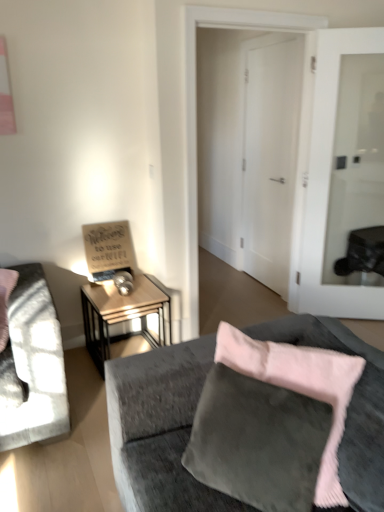
This screenshot has width=384, height=512. What do you see at coordinates (324, 178) in the screenshot?
I see `white glass door at center, the 2th door from the left` at bounding box center [324, 178].

This screenshot has width=384, height=512. Describe the element at coordinates (270, 157) in the screenshot. I see `white smooth door at center, the first door from the left` at that location.

Image resolution: width=384 pixels, height=512 pixels. What do you see at coordinates (123, 282) in the screenshot? I see `metallic silver table lamp at left` at bounding box center [123, 282].

Where is `white glass door at center, the 2th door from the left`? white glass door at center, the 2th door from the left is located at coordinates point(324,178).

Is metallic silver table lamp at left at the back of white glass door at center, the 2th door from the left?

No.

Is white glass door at center, the 2th door from the left, outside of metallic silver table lamp at left?

Absolutely, white glass door at center, the 2th door from the left, is external to metallic silver table lamp at left.

Which object is closer to the camera, white glass door at center, the 2th door from the left, or metallic silver table lamp at left?

white glass door at center, the 2th door from the left, is in front.

Which object is thinner, velvet gray couch at lower right or white smooth door at center, the 2th door positioned from the right?

white smooth door at center, the 2th door positioned from the right, is thinner.

Is velvet gray couch at lower right positioned before white smooth door at center, the 2th door positioned from the right?

Yes, velvet gray couch at lower right is in front of white smooth door at center, the 2th door positioned from the right.

In terms of size, does velvet gray couch at lower right appear bigger or smaller than white smooth door at center, the first door from the left?

Clearly, velvet gray couch at lower right is larger in size than white smooth door at center, the first door from the left.

Find the location of a particular element. This screenshot has width=384, height=512. studio couch located on the left of white smooth door at center, the first door from the left is located at coordinates (157, 425).

From the image's perspective, is metallic silver table lamp at left located above or below white smooth door at center, the first door from the left?

metallic silver table lamp at left is below white smooth door at center, the first door from the left.

Is point (114, 283) closer to viewer compared to point (269, 52)?

Yes, point (114, 283) is closer to viewer.

Is metallic silver table lamp at left not inside white smooth door at center, the 2th door positioned from the right?

Absolutely, metallic silver table lamp at left is external to white smooth door at center, the 2th door positioned from the right.

Considering the sizes of objects metallic silver table lamp at left and white smooth door at center, the first door from the left, in the image provided, who is smaller, metallic silver table lamp at left or white smooth door at center, the first door from the left,?

Smaller between the two is metallic silver table lamp at left.

In order to click on table in front of the white glass door at center, the 1th door in the right-to-left sequence in this screenshot , I will do `click(122, 313)`.

Is white glass door at center, the 1th door in the right-to-left sequence, wider or thinner than wooden side table at center left?

In the image, white glass door at center, the 1th door in the right-to-left sequence, appears to be more narrow than wooden side table at center left.

In the scene shown: Is the surface of white glass door at center, the 2th door from the left, in direct contact with wooden side table at center left?

No, white glass door at center, the 2th door from the left, is not next to wooden side table at center left.

From the image's perspective, is white glass door at center, the 2th door from the left, located above wooden side table at center left?

Yes.

Starting from the metallic silver table lamp at left, which door is the 1st one to the right? Please provide its 2D coordinates.

[(270, 157)]

Is point (278, 237) positioned after point (118, 286)?

Yes.

Between white smooth door at center, the 2th door positioned from the right, and metallic silver table lamp at left, which one has smaller size?

metallic silver table lamp at left.

From the image's perspective, which is below, white smooth door at center, the first door from the left, or metallic silver table lamp at left?

metallic silver table lamp at left.

From the image's perspective, which one is positioned lower, white glass door at center, the 2th door from the left, or white smooth door at center, the first door from the left?

white glass door at center, the 2th door from the left, from the image's perspective.

Is point (318, 45) farther from viewer compared to point (285, 242)?

No.

How many degrees apart are the facing directions of white glass door at center, the 1th door in the right-to-left sequence, and white smooth door at center, the 2th door positioned from the right?

58.9 degrees separate the facing orientations of white glass door at center, the 1th door in the right-to-left sequence, and white smooth door at center, the 2th door positioned from the right.

Is velvet gray couch at lower right shorter than wooden side table at center left?

In fact, velvet gray couch at lower right may be taller than wooden side table at center left.

From the image's perspective, does velvet gray couch at lower right appear lower than wooden side table at center left?

Correct, velvet gray couch at lower right appears lower than wooden side table at center left in the image.

What's the angular difference between velvet gray couch at lower right and wooden side table at center left's facing directions?

There is a 92.9-degree angle between the facing directions of velvet gray couch at lower right and wooden side table at center left.

I want to click on table lamp that is below the white glass door at center, the 1th door in the right-to-left sequence (from the image's perspective), so click(x=123, y=282).

This screenshot has height=512, width=384. Find the location of `studio couch below the white smooth door at center, the first door from the left (from a real-world perspective)`. studio couch below the white smooth door at center, the first door from the left (from a real-world perspective) is located at coordinates (157, 425).

When comparing their distances from white glass door at center, the 1th door in the right-to-left sequence, does velvet gray couch at lower right or white smooth door at center, the 2th door positioned from the right, seem closer?

The object closer to white glass door at center, the 1th door in the right-to-left sequence, is white smooth door at center, the 2th door positioned from the right.

Considering their positions, is metallic silver table lamp at left positioned closer to velvet gray couch at lower right than white glass door at center, the 2th door from the left?

metallic silver table lamp at left is closer to velvet gray couch at lower right.

Which object lies further to the anchor point wooden side table at center left, wooden sign at left or metallic silver table lamp at left?

The object further to wooden side table at center left is wooden sign at left.

From the picture: From the image, which object appears to be nearer to white smooth door at center, the first door from the left, wooden side table at center left or metallic silver table lamp at left?

wooden side table at center left is positioned closer to the anchor white smooth door at center, the first door from the left.

From the image, which object appears to be nearer to wooden sign at left, white glass door at center, the 1th door in the right-to-left sequence, or white smooth door at center, the 2th door positioned from the right?

The object closer to wooden sign at left is white glass door at center, the 1th door in the right-to-left sequence.

Considering their positions, is white smooth door at center, the 2th door positioned from the right, positioned further to white glass door at center, the 2th door from the left, than metallic silver table lamp at left?

Based on the image, metallic silver table lamp at left appears to be further to white glass door at center, the 2th door from the left.

Which object lies nearer to the anchor point wooden side table at center left, velvet gray couch at lower right or wooden sign at left?

wooden sign at left is positioned closer to the anchor wooden side table at center left.

Looking at the image, which one is located further to velvet gray couch at lower right, wooden side table at center left or white smooth door at center, the first door from the left?

Based on the image, white smooth door at center, the first door from the left, appears to be further to velvet gray couch at lower right.

Where is `door located between wooden sign at left and white glass door at center, the 1th door in the right-to-left sequence, in the left-right direction`? door located between wooden sign at left and white glass door at center, the 1th door in the right-to-left sequence, in the left-right direction is located at coordinates (270, 157).

Image resolution: width=384 pixels, height=512 pixels. What are the coordinates of `bulletin board positioned between velvet gray couch at lower right and white smooth door at center, the first door from the left, from near to far` in the screenshot? It's located at (108, 249).

What are the coordinates of `door positioned between velvet gray couch at lower right and white smooth door at center, the 2th door positioned from the right, from near to far` in the screenshot? It's located at (324, 178).

Locate an element on the screen. table between velvet gray couch at lower right and wooden sign at left from front to back is located at coordinates (122, 313).